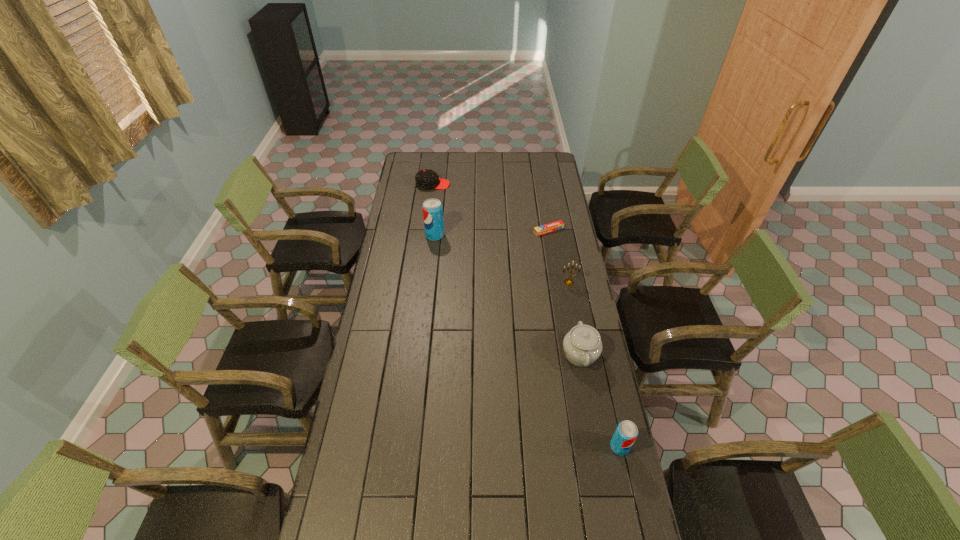
This screenshot has height=540, width=960. I want to click on vacant space in between the candelabrum and the toothpaste, so click(559, 256).

Identify the location of vacant area that lies between the farthest object and the candelabrum. The height and width of the screenshot is (540, 960). (501, 233).

Image resolution: width=960 pixels, height=540 pixels. Find the location of `empty location between the candelabrum and the fifth farthest object`. empty location between the candelabrum and the fifth farthest object is located at coordinates (575, 319).

Locate an element on the screen. free area in between the tallest object and the chinaware is located at coordinates (508, 295).

This screenshot has height=540, width=960. What are the coordinates of `vacant space in between the third nearest object and the shortest object` in the screenshot? It's located at (559, 256).

You are a GUI agent. You are given a task and a screenshot of the screen. Output one action in this format:
    pyautogui.click(x=<x>, y=<y>)
    Task: Click on the vacant space that is in between the farther soda can and the fifth farthest object
    
    Given the screenshot: What is the action you would take?
    pyautogui.click(x=508, y=295)

At what (x,y) coordinates should I click in order to perform the action: click on vacant space that's between the farthest object and the shortest object. Please return your answer as a coordinate pair (x, y). Looking at the image, I should click on pos(491,207).

Choose which object is the fourth nearest neighbor to the fifth farthest object. Please provide its 2D coordinates. Your answer should be formatted as a tuple, i.e. [(x, y)], where the tuple contains the x and y coordinates of a point satisfying the conditions above.

[(432, 208)]

You are a GUI agent. You are given a task and a screenshot of the screen. Output one action in this format:
    pyautogui.click(x=<x>, y=<y>)
    Task: Click on the third closest object to the farther soda can
    The image size is (960, 540).
    Given the screenshot: What is the action you would take?
    pyautogui.click(x=569, y=282)

Find the location of a particular element. free location that satisfies the following two spatial constraints: 1. on the front-facing side of the taller soda can; 2. on the right side of the farthest object is located at coordinates tap(426, 235).